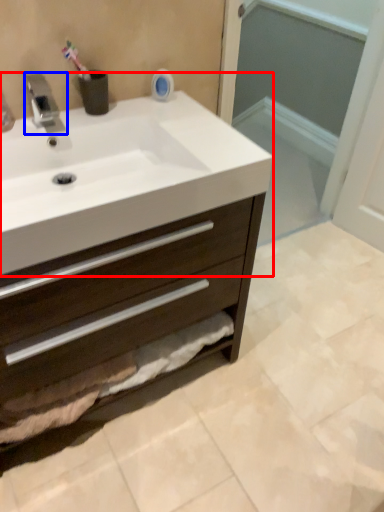
Question: Which of the following is the farthest to the observer, sink (highlighted by a red box) or tap (highlighted by a blue box)?

Choices:
 (A) sink
 (B) tap

Answer: (B)